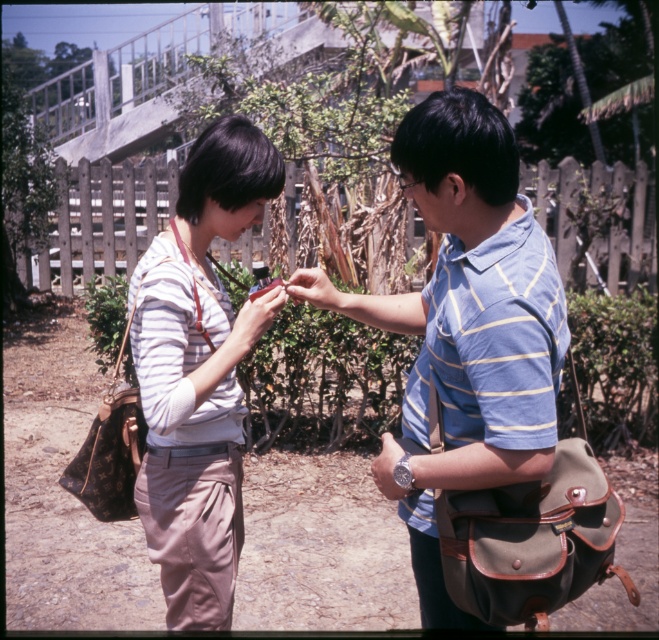
You are taking a photo of two people standing in front of you. You notice two points marked in the image. The first point is at coordinate point (x=432, y=141) and the second is at point (x=339, y=307). Which point is closer to your camera lens?

Point (x=432, y=141) is closer to the camera lens than point (x=339, y=307).

Based on the photo, you are a delivery person who needs to place a 20 inch package between the matte green bag at right and the matte brown purse at center. Is there enough space?

The distance between the matte green bag at right and the matte brown purse at center is 23.02 inches, so yes, the 20 inch package can fit between them.